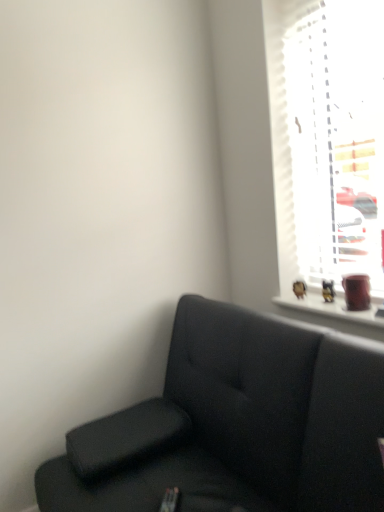
Question: Is white textured blinds at upper right wider or thinner than suede black couch at lower right?

Choices:
 (A) wide
 (B) thin

Answer: (B)

Question: Is white textured blinds at upper right in front of or behind suede black couch at lower right in the image?

Choices:
 (A) front
 (B) behind

Answer: (B)

Question: From their relative heights in the image, would you say white textured blinds at upper right is taller or shorter than suede black couch at lower right?

Choices:
 (A) short
 (B) tall

Answer: (B)

Question: Is suede black couch at lower right in front of or behind white textured blinds at upper right in the image?

Choices:
 (A) front
 (B) behind

Answer: (A)

Question: Is suede black couch at lower right bigger or smaller than white textured blinds at upper right?

Choices:
 (A) big
 (B) small

Answer: (A)

Question: Which is correct: suede black couch at lower right is inside white textured blinds at upper right, or outside of it?

Choices:
 (A) inside
 (B) outside

Answer: (B)

Question: Looking at their shapes, would you say suede black couch at lower right is wider or thinner than white textured blinds at upper right?

Choices:
 (A) wide
 (B) thin

Answer: (A)